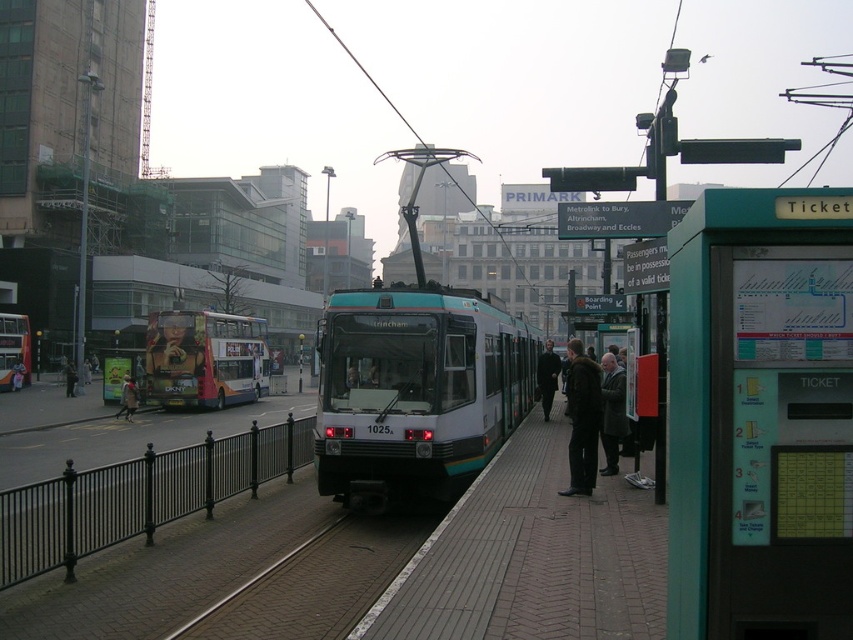
Who is shorter, teal glossy tram at center or matte black bus at left?

teal glossy tram at center is shorter.

Who is positioned more to the left, teal glossy tram at center or matte black bus at left?

matte black bus at left is more to the left.

Does point (369, 448) come farther from viewer compared to point (9, 356)?

No, it is not.

Locate an element on the screen. This screenshot has width=853, height=640. teal glossy tram at center is located at coordinates (416, 388).

This screenshot has height=640, width=853. Find the location of `dark brown leather coat at center`. dark brown leather coat at center is located at coordinates (582, 419).

Between point (575, 458) and point (548, 349), which one is positioned in front?

Point (575, 458) is more forward.

The image size is (853, 640). In order to click on dark brown leather coat at center in this screenshot , I will do pos(582,419).

What are the coordinates of `dark brown leather coat at center` in the screenshot? It's located at (582, 419).

Which of these two, teal glossy tram at center or denim jacket at left, stands taller?

Standing taller between the two is teal glossy tram at center.

Which is below, teal glossy tram at center or denim jacket at left?

denim jacket at left is lower down.

Between point (456, 456) and point (117, 417), which one is positioned in front?

Point (456, 456)

Find the location of a particular element. The image size is (853, 640). teal glossy tram at center is located at coordinates (416, 388).